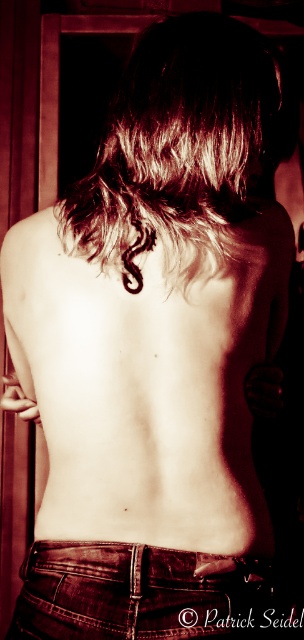
You are taking a photo of a person from behind and want to ensure that both the dark brown wavy hair at center and the jeans at lower center are clearly visible. Based on the scene, which object is closer to the camera and might block the other?

The dark brown wavy hair at center is closer to the camera than the jeans at lower center, so it might block the jeans at lower center if not positioned carefully.

You are taking a photo of a person from behind. You notice two points on their body at coordinates point [183,116] and point [196,589]. If you want to focus on the point closer to the camera, which coordinate should you adjust your camera to focus on?

Point [196,589] is closer to the camera than point [183,116], so you should focus on point [196,589].